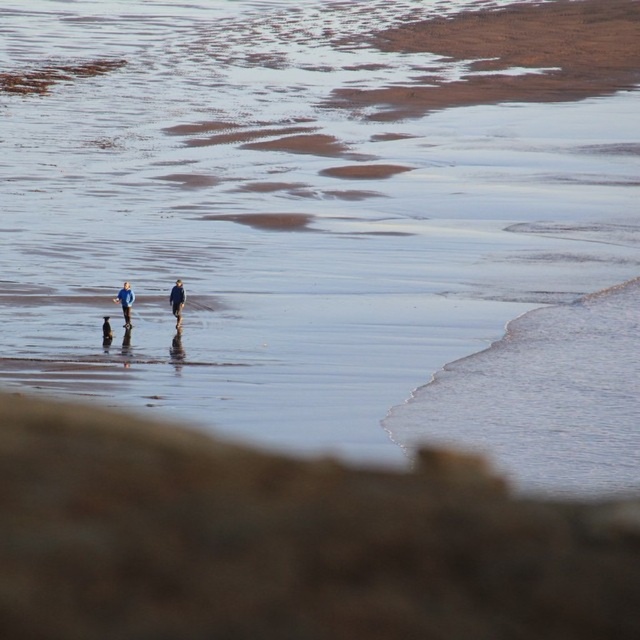
The height and width of the screenshot is (640, 640). Describe the element at coordinates (285, 541) in the screenshot. I see `brown sandy beach at lower center` at that location.

Does point (364, 596) lie in front of point (173, 301)?

That is True.

Locate an element on the screen. The image size is (640, 640). brown sandy beach at lower center is located at coordinates (285, 541).

Is the position of brown sandy beach at lower center more distant than that of blue fabric jacket at left?

No, it is in front of blue fabric jacket at left.

Can you confirm if brown sandy beach at lower center is thinner than blue fabric jacket at left?

No, brown sandy beach at lower center is not thinner than blue fabric jacket at left.

Is point (209, 576) in front of point (125, 298)?

Yes, it is in front of point (125, 298).

The width and height of the screenshot is (640, 640). Find the location of `brown sandy beach at lower center`. brown sandy beach at lower center is located at coordinates (285, 541).

Who is lower down, blue fabric jacket at left or dark blue fabric at center?

Positioned lower is blue fabric jacket at left.

Find the location of `blue fabric jacket at left`. blue fabric jacket at left is located at coordinates (125, 301).

Where is `blue fabric jacket at left`? The height and width of the screenshot is (640, 640). blue fabric jacket at left is located at coordinates (125, 301).